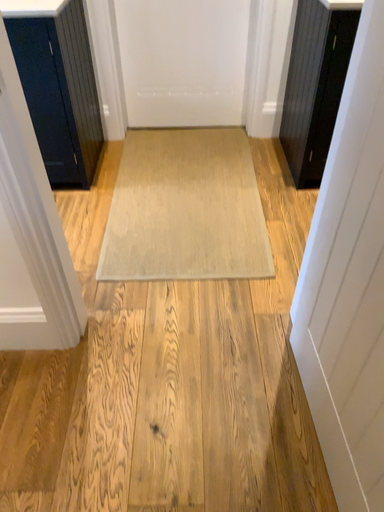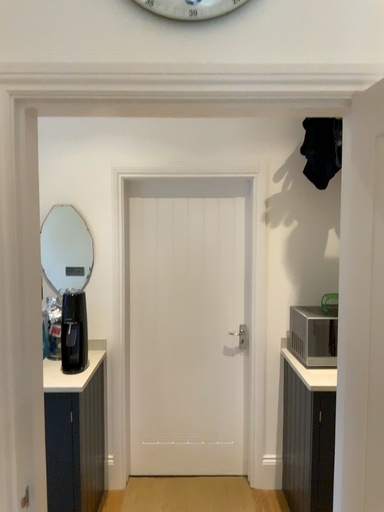
Question: How did the camera likely rotate when shooting the video?

Choices:
 (A) rotated upward
 (B) rotated downward

Answer: (A)